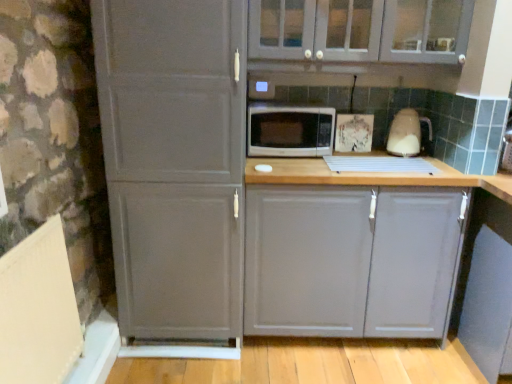
Find the location of a particular element. The width and height of the screenshot is (512, 384). vacant space in front of white glossy kettle at right is located at coordinates (424, 166).